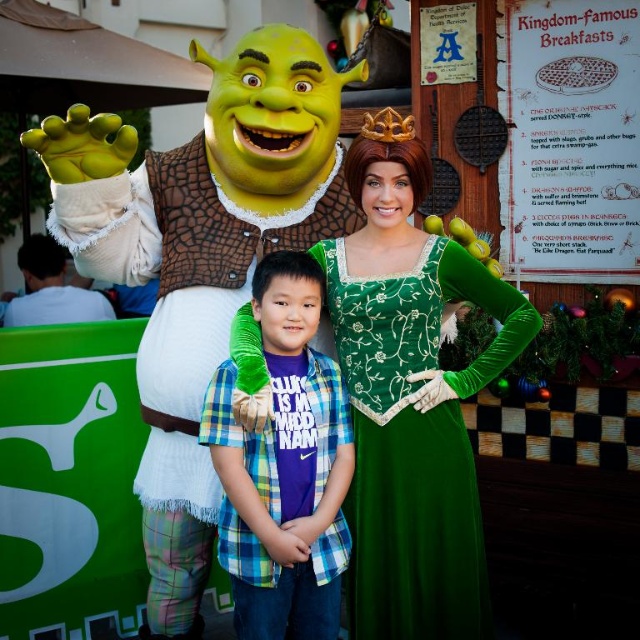
Is matte green costume at left smaller than velvet green dress at center?

Actually, matte green costume at left might be larger than velvet green dress at center.

From the picture: Is matte green costume at left wider than velvet green dress at center?

Correct, the width of matte green costume at left exceeds that of velvet green dress at center.

Does point (220, 266) come behind point (413, 547)?

Yes, it is behind point (413, 547).

Where is `matte green costume at left`? The height and width of the screenshot is (640, 640). matte green costume at left is located at coordinates (198, 257).

Is velvet green dress at center above plaid shirt at center?

Correct, velvet green dress at center is located above plaid shirt at center.

Which is in front, point (372, 490) or point (316, 396)?

Point (316, 396) is more forward.

Identify the location of velvet green dress at center. This screenshot has width=640, height=640. point(416,442).

Where is `matte green costume at left`? The image size is (640, 640). matte green costume at left is located at coordinates (198, 257).

Is matte green costume at left shorter than plaid shirt at center?

In fact, matte green costume at left may be taller than plaid shirt at center.

Between point (209, 168) and point (307, 412), which one is positioned in front?

Positioned in front is point (307, 412).

The height and width of the screenshot is (640, 640). In order to click on matte green costume at left in this screenshot , I will do `click(198, 257)`.